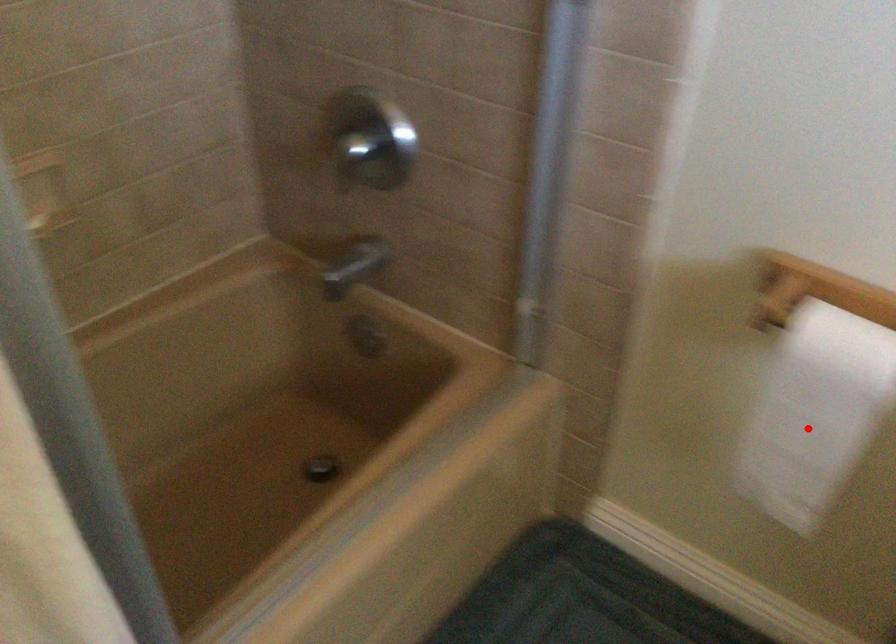
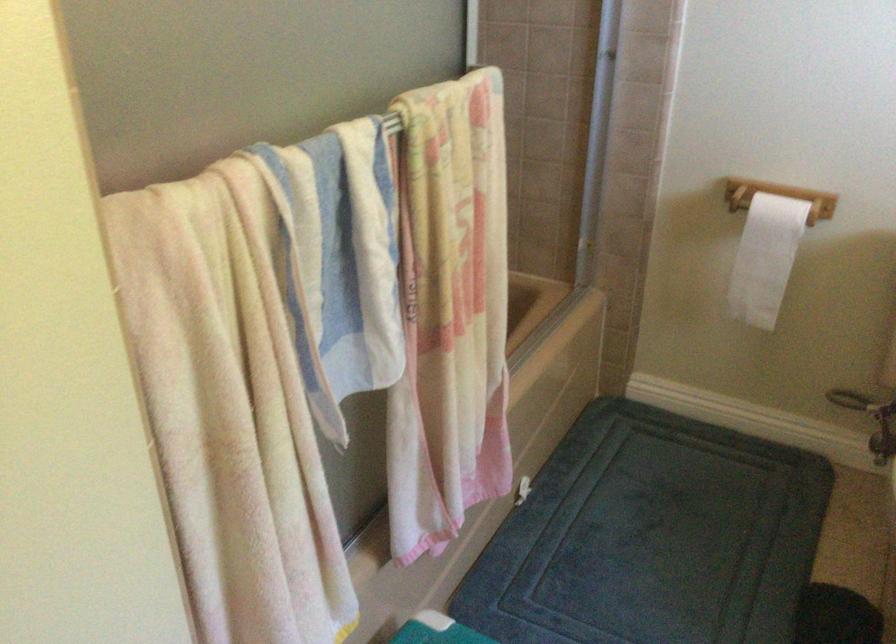
Question: A red point is marked in image1. In image2, is the corresponding 3D point closer to the camera or farther? Reply with the corresponding letter.

Choices:
 (A) The corresponding 3D point is closer.
 (B) The corresponding 3D point is farther.

Answer: (B)